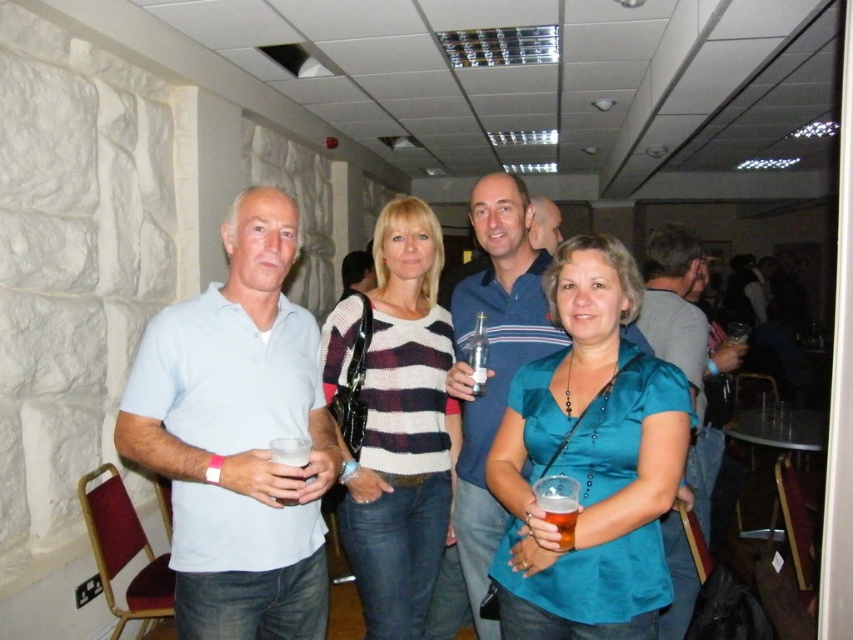
You are a bartender preparing to serve a drink to the person wearing the teal satin blouse at center and the person holding the translucent plastic cup at center. Which of the two should you approach first to ensure the drink reaches the taller object they are holding?

The teal satin blouse at center is taller than the translucent plastic cup at center, so you should approach the person wearing the teal satin blouse at center first to ensure the drink reaches the taller object they are holding.

Looking at this image, you are a bartender preparing to serve drinks. You see the light blue polo shirt at left and the clear plastic cup at center. Which item is wider?

The light blue polo shirt at left is wider than the clear plastic cup at center according to the description.